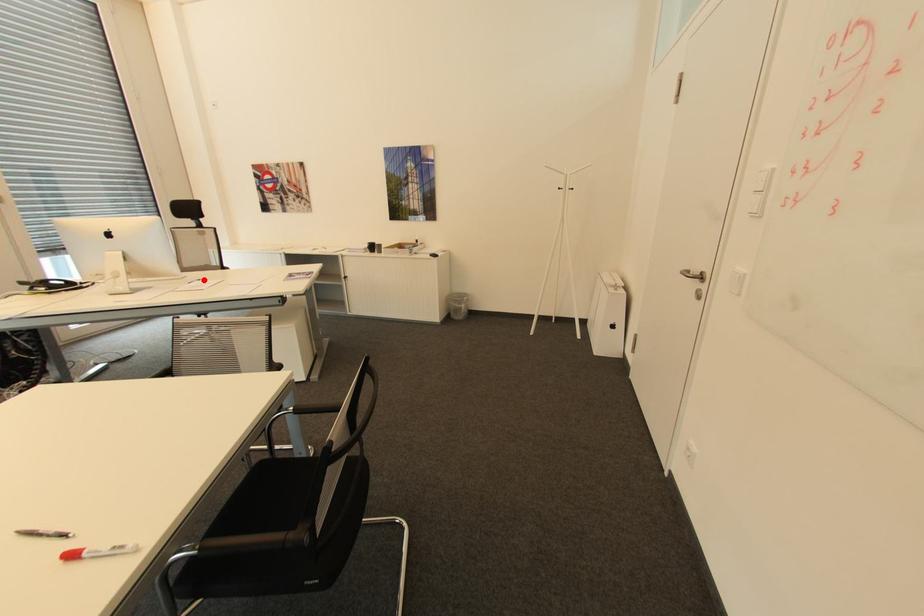
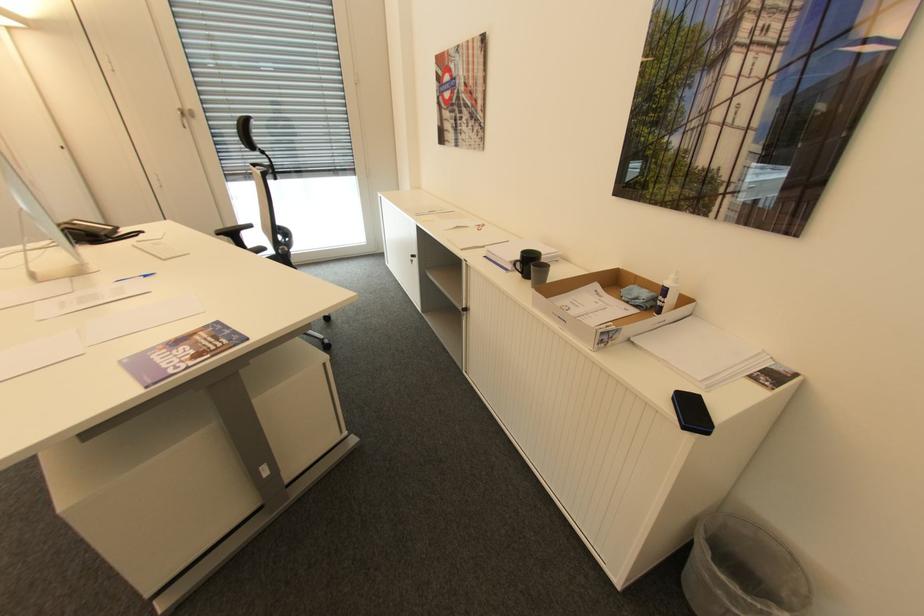
In the second image, find the point that corresponds to the highlighted location in the first image.

(150, 276)